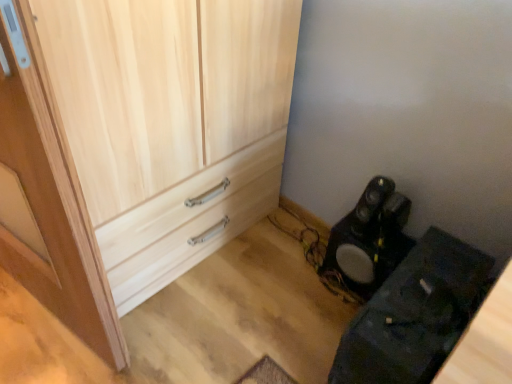
This screenshot has height=384, width=512. I want to click on vacant area that lies between wooden door at left and black matte speaker at lower right, so click(234, 302).